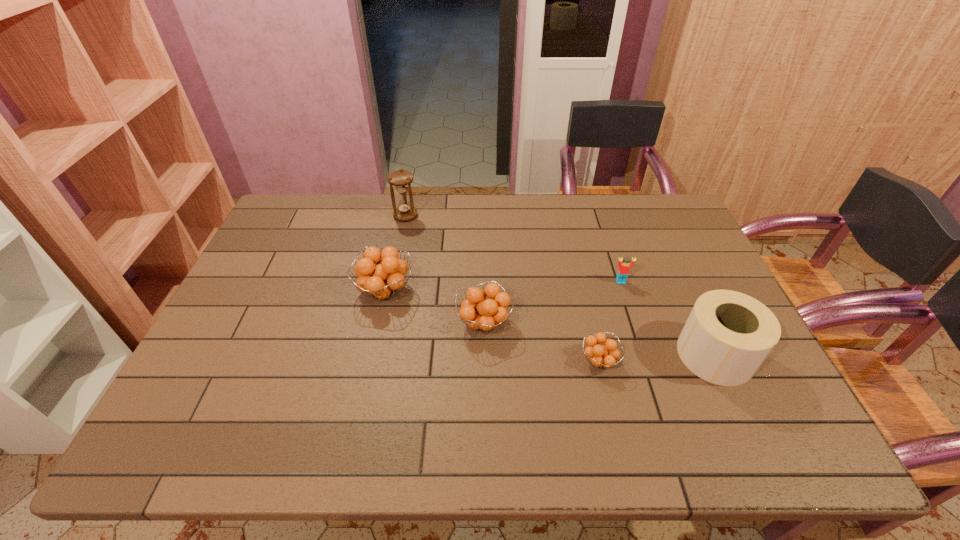
The image size is (960, 540). What are the coordinates of `free space at the far edge` in the screenshot? It's located at (563, 215).

Where is `vacant space at the left edge of the desktop`? vacant space at the left edge of the desktop is located at coordinates (258, 332).

In the image, there is a desktop. Identify the location of free space at the right edge. (673, 291).

This screenshot has width=960, height=540. What are the coordinates of `free space between the fifth object from left to right and the hourglass` in the screenshot? It's located at (514, 249).

The width and height of the screenshot is (960, 540). Identify the location of free spot between the fifth tallest object and the shortest object. (611, 321).

Where is `vacant area between the hourglass and the fourth tallest object`? This screenshot has height=540, width=960. vacant area between the hourglass and the fourth tallest object is located at coordinates (444, 269).

Locate an element on the screen. This screenshot has height=540, width=960. vacant space in between the hourglass and the shortest object is located at coordinates (503, 288).

Identify the location of free space between the second orange fruit from right to left and the fourth object from left to right. (542, 342).

I want to click on vacant area between the second shortest object and the leftmost orange fruit, so click(503, 286).

I want to click on free point between the shortest orange fruit and the third object from left to right, so click(542, 342).